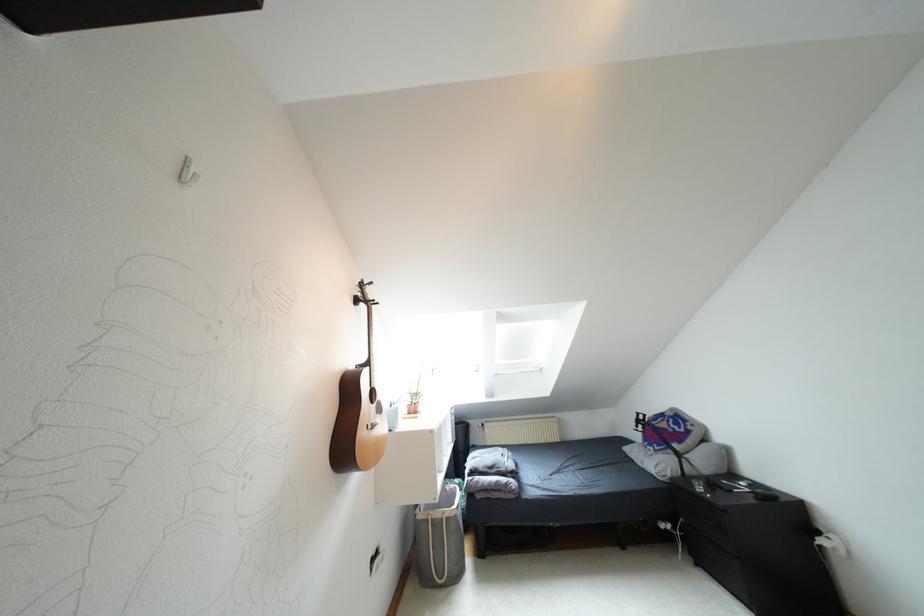
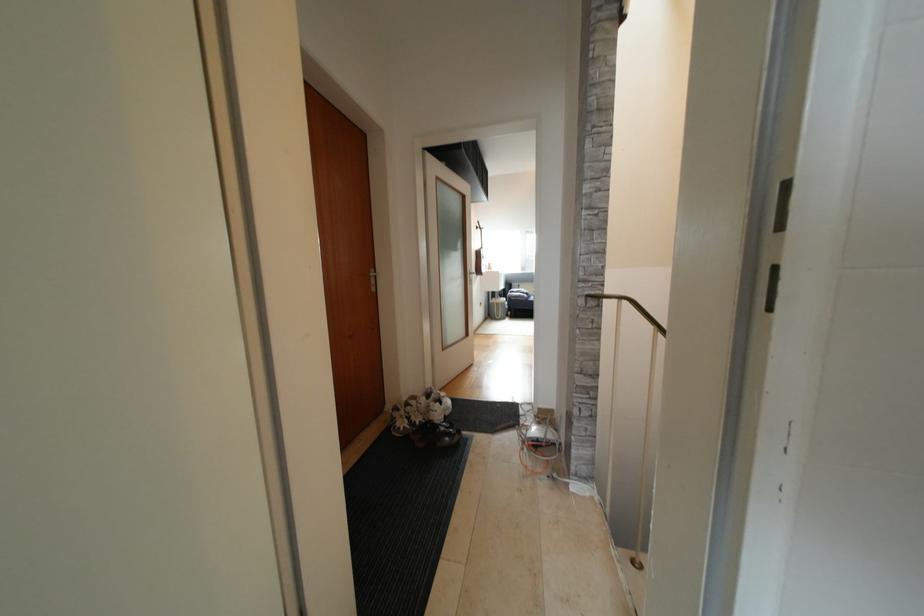
Question: The images are taken continuously from a first-person perspective. In which direction are you moving?

Choices:
 (A) Left
 (B) Right
 (C) Forward
 (D) Backward

Answer: (D)